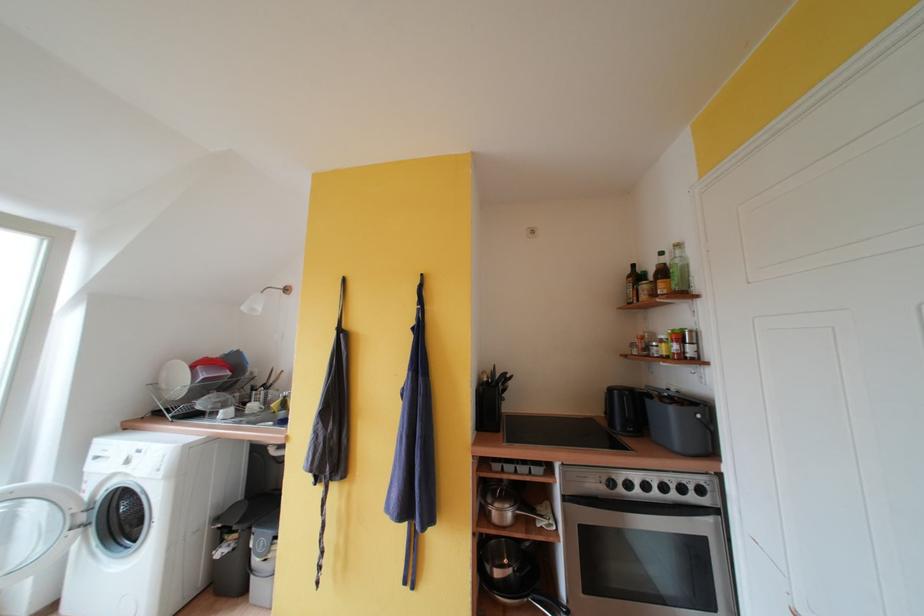
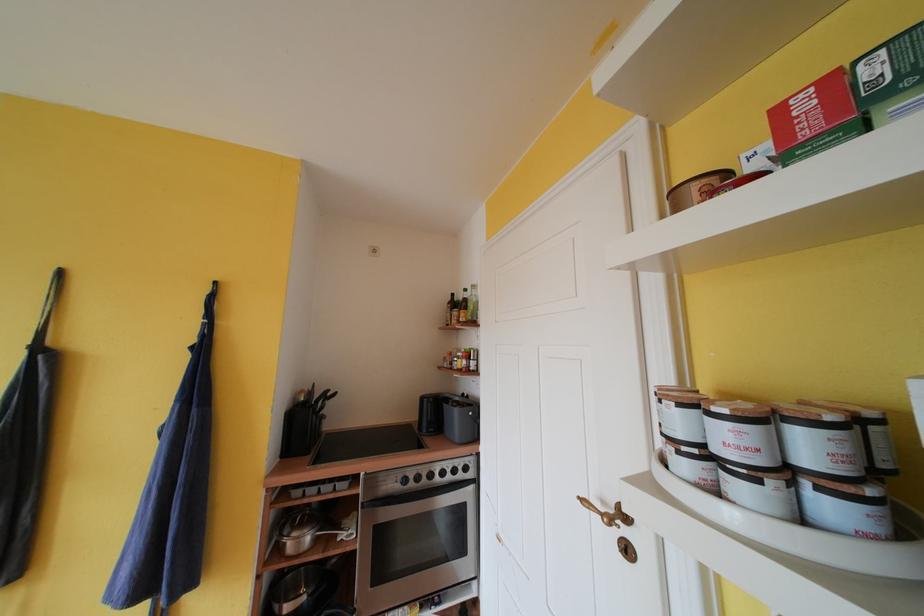
Locate, in the second image, the point that corresponds to (678,490) in the first image.

(455, 474)